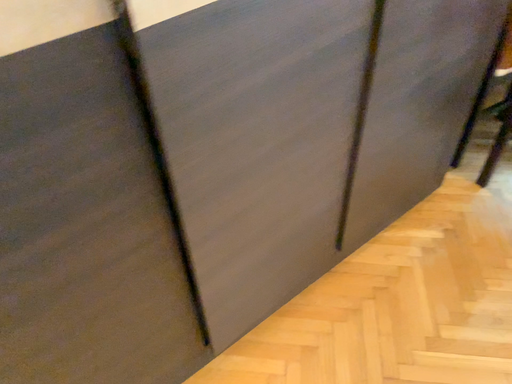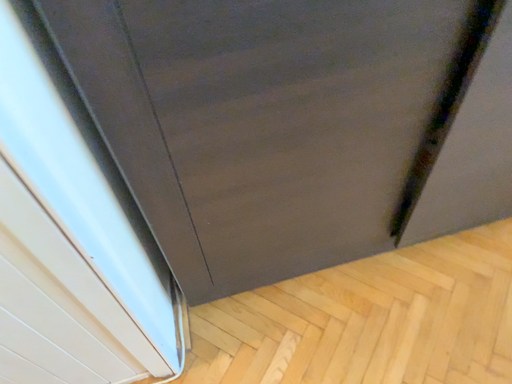
Question: Which way did the camera rotate in the video?

Choices:
 (A) rotated left
 (B) rotated right

Answer: (A)